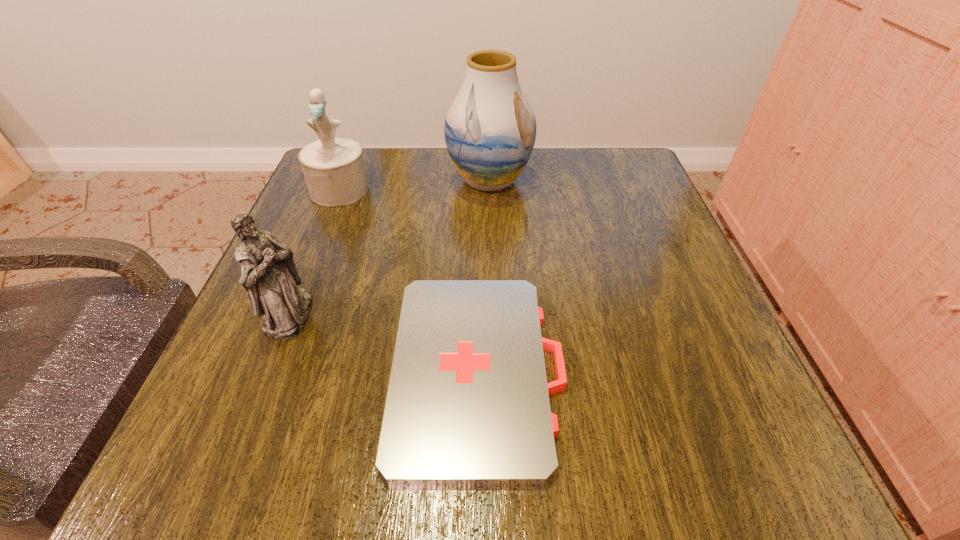
Where is `object that is at the near edge`? The height and width of the screenshot is (540, 960). object that is at the near edge is located at coordinates (468, 403).

The image size is (960, 540). In order to click on object that is at the far left corner in this screenshot , I will do `click(334, 169)`.

Where is `vacant space at the far edge of the desktop`? Image resolution: width=960 pixels, height=540 pixels. vacant space at the far edge of the desktop is located at coordinates (431, 197).

In the image, there is a desktop. Where is `free space at the left edge`? This screenshot has height=540, width=960. free space at the left edge is located at coordinates (312, 284).

Find the location of `vacant region at the right edge`. vacant region at the right edge is located at coordinates (693, 370).

The image size is (960, 540). What are the coordinates of `vacant space at the near left corner of the desktop` in the screenshot? It's located at (255, 454).

Where is `blank area at the far right corner`? Image resolution: width=960 pixels, height=540 pixels. blank area at the far right corner is located at coordinates (630, 180).

You are a GUI agent. You are given a task and a screenshot of the screen. Output one action in this format:
    pyautogui.click(x=<x>, y=<y>)
    Task: Click on the free space between the nearer figurine and the shortest object
    
    Given the screenshot: What is the action you would take?
    pyautogui.click(x=384, y=342)

Locate an element on the screen. free area in between the farther figurine and the nearer figurine is located at coordinates (314, 252).

Where is `free space between the shortest object and the farther figurine`? free space between the shortest object and the farther figurine is located at coordinates (409, 279).